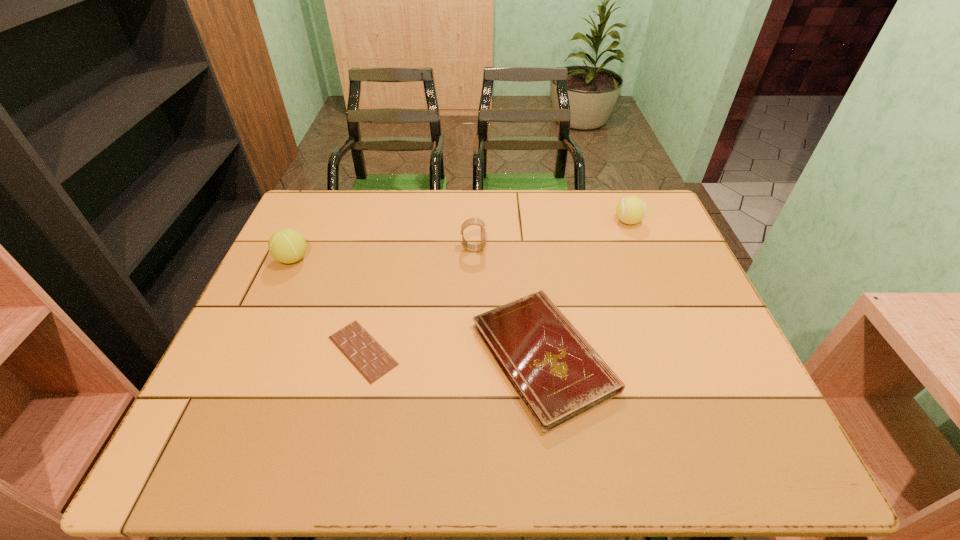
This screenshot has width=960, height=540. Identify the location of watch. (471, 221).

Where is `the left tennis ball`? This screenshot has height=540, width=960. the left tennis ball is located at coordinates (286, 245).

What are the coordinates of `the nearer tennis ball` in the screenshot? It's located at (286, 245).

Locate an element on the screen. The image size is (960, 540). the farthest object is located at coordinates (630, 210).

What are the coordinates of `the right tennis ball` in the screenshot? It's located at (630, 210).

At what (x,y) coordinates should I click in order to perform the action: click on notebook. Please return your answer as a coordinate pair (x, y). The height and width of the screenshot is (540, 960). Looking at the image, I should click on (556, 373).

Find the location of `the shortest object`. the shortest object is located at coordinates (360, 348).

Where is `the second object from left to right`? This screenshot has height=540, width=960. the second object from left to right is located at coordinates (360, 348).

Find the location of a particular element. The image size is (960, 540). free point located 0.230m on the face of the watch is located at coordinates (565, 249).

Identify the location of vacant space located on the front of the leftmost object. (273, 303).